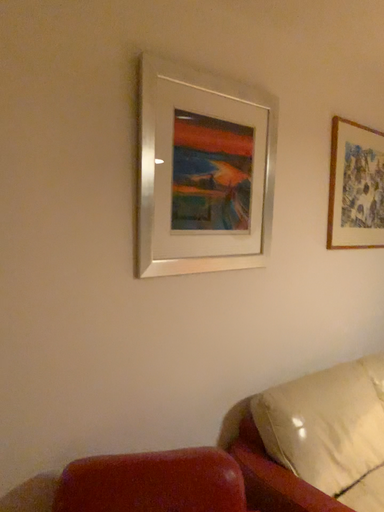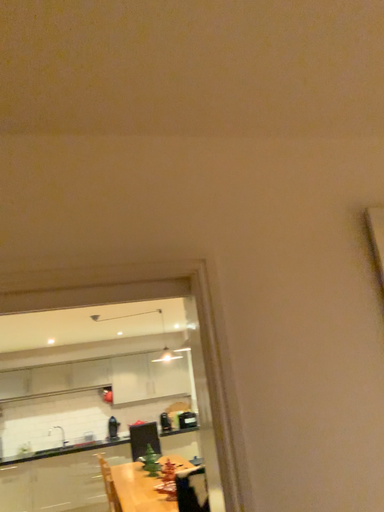
Question: Which way did the camera rotate in the video?

Choices:
 (A) rotated left
 (B) rotated right

Answer: (A)